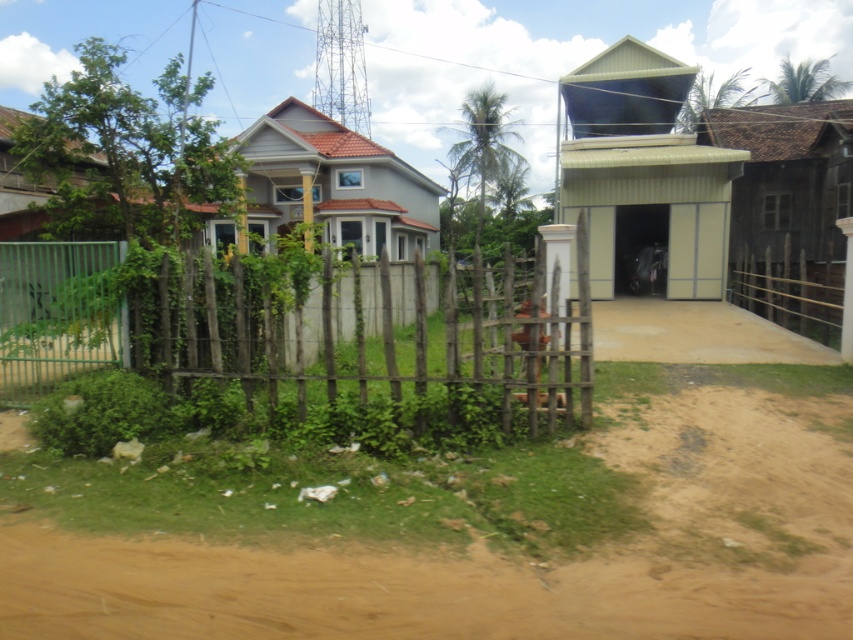
Is point (502, 307) positioned after point (689, 237)?

No, it is in front of (689, 237).

Is the position of green wooden fence at left more distant than that of metallic corrugated hut at upper right?

No, it is not.

Is point (363, 292) farther from viewer compared to point (648, 182)?

No.

The width and height of the screenshot is (853, 640). Find the location of `green wooden fence at left`. green wooden fence at left is located at coordinates (355, 332).

Based on the photo, is green wooden fence at left below matte gray house at center?

Yes.

Is green wooden fence at left bigger than matte gray house at center?

→ No.

Is point (119, 323) farther from viewer compared to point (387, 184)?

No, (119, 323) is closer to viewer.

I want to click on green wooden fence at left, so point(355,332).

Does metallic corrugated hut at upper right appear on the left side of wooden hut at right?

Yes, metallic corrugated hut at upper right is to the left of wooden hut at right.

Is metallic corrugated hut at upper right taller than wooden hut at right?

No.

Is point (567, 150) less distant than point (734, 208)?

That is True.

Identify the location of metallic corrugated hut at upper right. (643, 168).